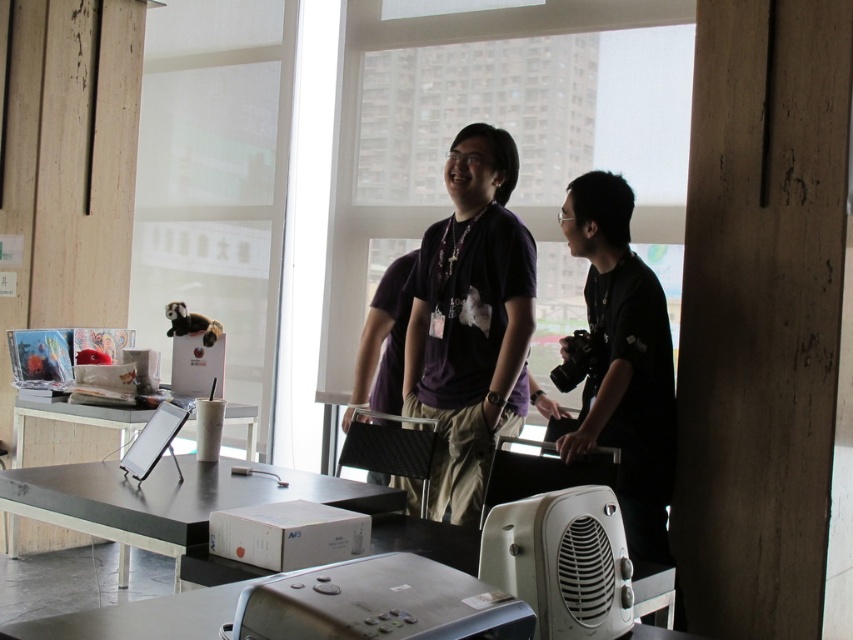
Can you confirm if purple matte shirt at center is bigger than black glossy tablet at center?

No, purple matte shirt at center is not bigger than black glossy tablet at center.

Is purple matte shirt at center to the left of black glossy tablet at center from the viewer's perspective?

No, purple matte shirt at center is not to the left of black glossy tablet at center.

Which is behind, point (490, 323) or point (242, 417)?

Positioned behind is point (242, 417).

Image resolution: width=853 pixels, height=640 pixels. What are the coordinates of `purple matte shirt at center` in the screenshot? It's located at (469, 321).

The width and height of the screenshot is (853, 640). What are the coordinates of `black matte table at center` in the screenshot? It's located at (164, 500).

Locate an element on the screen. black matte table at center is located at coordinates (164, 500).

Which is behind, point (302, 493) or point (233, 404)?

The point (233, 404) is behind.

Is black matte table at center positioned behind black glossy tablet at center?

No, black matte table at center is in front of black glossy tablet at center.

The width and height of the screenshot is (853, 640). What are the coordinates of `black matte table at center` in the screenshot? It's located at (164, 500).